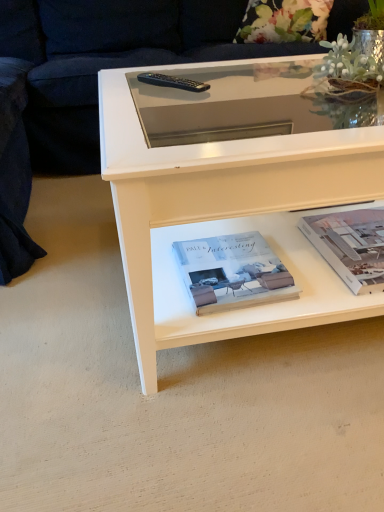
Where is `white matte book at center, the 2th paperback book viewed from the right`? white matte book at center, the 2th paperback book viewed from the right is located at coordinates [x=232, y=272].

Image resolution: width=384 pixels, height=512 pixels. What do you see at coordinates (172, 82) in the screenshot?
I see `black plastic remote at upper center` at bounding box center [172, 82].

The height and width of the screenshot is (512, 384). What do you see at coordinates (284, 21) in the screenshot?
I see `floral fabric pillow at upper center` at bounding box center [284, 21].

At what (x,y) coordinates should I click in order to perform the action: click on dark blue fabric couch at upper left. Please return your answer as a coordinate pair (x, y). This screenshot has height=512, width=384. Looking at the image, I should click on (108, 61).

Where is `white matte book at center, the first paperback book positioned from the left`? This screenshot has height=512, width=384. white matte book at center, the first paperback book positioned from the left is located at coordinates (232, 272).

Based on their sizes in the image, would you say floral fabric pillow at upper center is bigger or smaller than dark blue fabric couch at upper left?

floral fabric pillow at upper center is smaller than dark blue fabric couch at upper left.

Who is more distant, floral fabric pillow at upper center or dark blue fabric couch at upper left?

floral fabric pillow at upper center is behind.

Which object is positioned more to the left, floral fabric pillow at upper center or dark blue fabric couch at upper left?

From the viewer's perspective, dark blue fabric couch at upper left appears more on the left side.

Considering the sizes of floral fabric pillow at upper center and dark blue fabric couch at upper left in the image, is floral fabric pillow at upper center wider or thinner than dark blue fabric couch at upper left?

Clearly, floral fabric pillow at upper center has less width compared to dark blue fabric couch at upper left.

Is point (253, 30) positioned before point (232, 276)?

That is False.

From a real-world perspective, is floral fabric pillow at upper center on top of white matte book at center, the first paperback book positioned from the left?

Yes, from a real-world perspective, floral fabric pillow at upper center is over white matte book at center, the first paperback book positioned from the left

From the picture: Is there a large distance between floral fabric pillow at upper center and white matte book at center, the 2th paperback book viewed from the right?

Indeed, floral fabric pillow at upper center is not near white matte book at center, the 2th paperback book viewed from the right.

Is black plastic remote at upper center facing towards white paper at lower right, positioned as the first paperback book in right-to-left order?

No, black plastic remote at upper center is not turned towards white paper at lower right, positioned as the first paperback book in right-to-left order.

From a real-world perspective, is black plastic remote at upper center physically located above or below white paper at lower right, positioned as the first paperback book in right-to-left order?

In terms of real-world spatial position, black plastic remote at upper center is above white paper at lower right, positioned as the first paperback book in right-to-left order.

From the black plastic remote at upper center, count 2nd paperback book to the right and point to it. Please provide its 2D coordinates.

[(350, 245)]

How different are the orientations of black plastic remote at upper center and white paper at lower right, which ranks as the second paperback book in left-to-right order, in degrees?

38.7 degrees separate the facing orientations of black plastic remote at upper center and white paper at lower right, which ranks as the second paperback book in left-to-right order.

Considering the positions of point (349, 247) and point (279, 289), is point (349, 247) closer or farther from the camera than point (279, 289)?

Point (349, 247).

In the image, is white paper at lower right, which ranks as the second paperback book in left-to-right order, positioned in front of or behind white matte book at center, the 2th paperback book viewed from the right?

white paper at lower right, which ranks as the second paperback book in left-to-right order, is behind white matte book at center, the 2th paperback book viewed from the right.

Which of these two, white paper at lower right, which ranks as the second paperback book in left-to-right order, or white matte book at center, the first paperback book positioned from the left, is wider?

white paper at lower right, which ranks as the second paperback book in left-to-right order.

Looking at this image, how distant is white paper at lower right, positioned as the first paperback book in right-to-left order, from black plastic remote at upper center?

white paper at lower right, positioned as the first paperback book in right-to-left order, is 24.48 inches away from black plastic remote at upper center.

Considering the points (327, 214) and (155, 73), which point is in front, point (327, 214) or point (155, 73)?

Point (327, 214)

Can you confirm if white paper at lower right, which ranks as the second paperback book in left-to-right order, is smaller than black plastic remote at upper center?

No, white paper at lower right, which ranks as the second paperback book in left-to-right order, is not smaller than black plastic remote at upper center.

Can you tell me how much white paper at lower right, which ranks as the second paperback book in left-to-right order, and black plastic remote at upper center differ in facing direction?

There is a 38.7-degree angle between the facing directions of white paper at lower right, which ranks as the second paperback book in left-to-right order, and black plastic remote at upper center.

Could you tell me if dark blue fabric couch at upper left is turned towards floral fabric pillow at upper center?

No.

From a real-world perspective, is dark blue fabric couch at upper left over floral fabric pillow at upper center?

No, from a real-world perspective, dark blue fabric couch at upper left is not over floral fabric pillow at upper center

Is dark blue fabric couch at upper left to the right of floral fabric pillow at upper center from the viewer's perspective?

Incorrect, dark blue fabric couch at upper left is not on the right side of floral fabric pillow at upper center.

Is floral fabric pillow at upper center beside black plastic remote at upper center?

No, floral fabric pillow at upper center is not beside black plastic remote at upper center.

From the image's perspective, relative to black plastic remote at upper center, is floral fabric pillow at upper center above or below?

floral fabric pillow at upper center is situated higher than black plastic remote at upper center in the image.

Which of these two, floral fabric pillow at upper center or black plastic remote at upper center, stands shorter?

black plastic remote at upper center.

From a real-world perspective, between floral fabric pillow at upper center and black plastic remote at upper center, who is vertically higher?

From a 3D spatial view, black plastic remote at upper center is above.

In the image, there is a floral fabric pillow at upper center. Where is `couch below it (from a real-world perspective)`? This screenshot has width=384, height=512. couch below it (from a real-world perspective) is located at coordinates (108, 61).

This screenshot has width=384, height=512. Identify the location of the 2nd paperback book in front when counting from the floral fabric pillow at upper center. (232, 272).

Based on their spatial positions, is black plastic remote at upper center or floral fabric pillow at upper center further from dark blue fabric couch at upper left?

Among the two, black plastic remote at upper center is located further to dark blue fabric couch at upper left.

Estimate the real-world distances between objects in this image. Which object is closer to floral fabric pillow at upper center, white matte book at center, the 2th paperback book viewed from the right, or black plastic remote at upper center?

Among the two, black plastic remote at upper center is located nearer to floral fabric pillow at upper center.

Which object lies further to the anchor point white matte book at center, the first paperback book positioned from the left, floral fabric pillow at upper center or dark blue fabric couch at upper left?

floral fabric pillow at upper center.

Looking at this image, which object lies nearer to the anchor point dark blue fabric couch at upper left, black plastic remote at upper center or white paper at lower right, which ranks as the second paperback book in left-to-right order?

Among the two, black plastic remote at upper center is located nearer to dark blue fabric couch at upper left.

From the image, which object appears to be nearer to white matte book at center, the 2th paperback book viewed from the right, black plastic remote at upper center or floral fabric pillow at upper center?

Based on the image, black plastic remote at upper center appears to be nearer to white matte book at center, the 2th paperback book viewed from the right.

When comparing their distances from black plastic remote at upper center, does white paper at lower right, positioned as the first paperback book in right-to-left order, or dark blue fabric couch at upper left seem closer?

Based on the image, white paper at lower right, positioned as the first paperback book in right-to-left order, appears to be nearer to black plastic remote at upper center.

From the image, which object appears to be farther from white matte book at center, the 2th paperback book viewed from the right, dark blue fabric couch at upper left or black plastic remote at upper center?

Based on the image, dark blue fabric couch at upper left appears to be further to white matte book at center, the 2th paperback book viewed from the right.

From the image, which object appears to be farther from floral fabric pillow at upper center, dark blue fabric couch at upper left or white paper at lower right, which ranks as the second paperback book in left-to-right order?

white paper at lower right, which ranks as the second paperback book in left-to-right order, lies further to floral fabric pillow at upper center than the other object.

Where is `remote between dark blue fabric couch at upper left and white matte book at center, the 2th paperback book viewed from the right, in the vertical direction`? The height and width of the screenshot is (512, 384). remote between dark blue fabric couch at upper left and white matte book at center, the 2th paperback book viewed from the right, in the vertical direction is located at coordinates (172, 82).

This screenshot has height=512, width=384. In order to click on remote between dark blue fabric couch at upper left and white paper at lower right, which ranks as the second paperback book in left-to-right order, in the up-down direction in this screenshot , I will do `click(172, 82)`.

You are a GUI agent. You are given a task and a screenshot of the screen. Output one action in this format:
    pyautogui.click(x=<x>, y=<y>)
    Task: Click on the remote between floral fabric pillow at upper center and white matte book at center, the first paperback book positioned from the left, from top to bottom
    
    Given the screenshot: What is the action you would take?
    pyautogui.click(x=172, y=82)

The height and width of the screenshot is (512, 384). In order to click on paperback book between floral fabric pillow at upper center and white matte book at center, the first paperback book positioned from the left, vertically in this screenshot , I will do `click(350, 245)`.